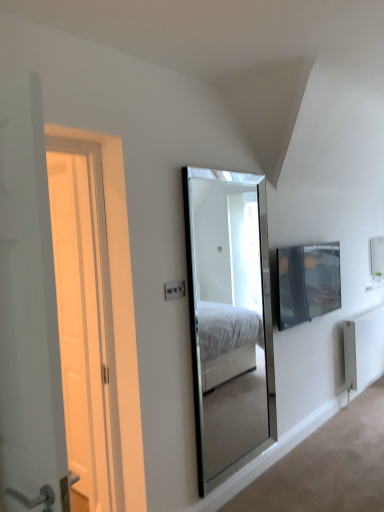
You are a GUI agent. You are given a task and a screenshot of the screen. Output one action in this format:
    pyautogui.click(x=<x>, y=<y>)
    Task: Click on the free location above clear glass mirror at center (from a real-world perspective)
    Image resolution: width=384 pixels, height=512 pixels.
    Given the screenshot: What is the action you would take?
    pyautogui.click(x=221, y=162)